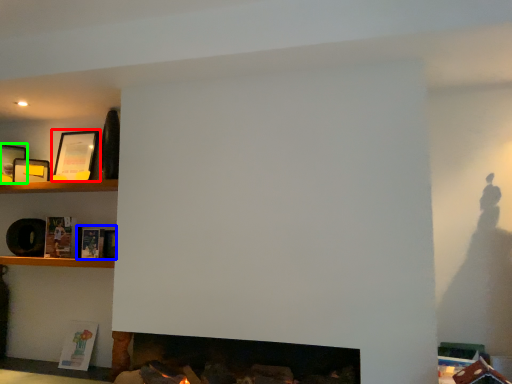
Question: Which object is positioned farthest from picture frame (highlighted by a red box)? Select from book (highlighted by a blue box) and picture frame (highlighted by a green box).

Choices:
 (A) book
 (B) picture frame

Answer: (A)